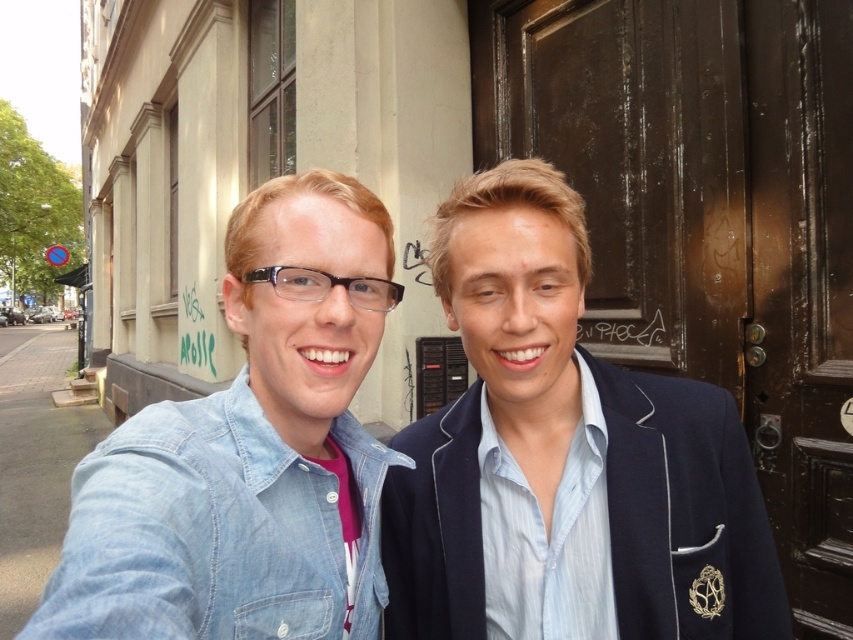
You are a fashion designer observing two denim jackets in the image. The denim jacket at center and the denim jacket at lower left. Which one is bigger?

The denim jacket at center is larger in size than the denim jacket at lower left.

You are a photographer trying to capture both the denim jacket at center and the denim jacket at lower left in a single frame. Based on their sizes in the image, which one appears larger?

The denim jacket at center appears larger because it is much taller than the denim jacket at lower left.